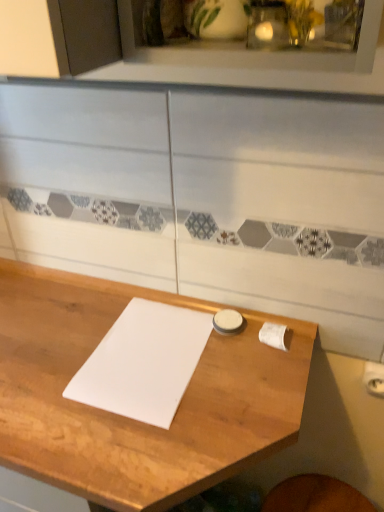
Find the location of `white matte journal at center`. white matte journal at center is located at coordinates (143, 362).

This screenshot has width=384, height=512. Describe the element at coordinates (143, 362) in the screenshot. I see `white matte journal at center` at that location.

I want to click on wooden table at center, so click(129, 419).

What do you see at coordinates (129, 419) in the screenshot? I see `wooden table at center` at bounding box center [129, 419].

The height and width of the screenshot is (512, 384). Identify the location of white matte journal at center. (143, 362).

Is white matte journal at center to the left of wooden table at center from the viewer's perspective?

No, white matte journal at center is not to the left of wooden table at center.

Which is behind, white matte journal at center or wooden table at center?

white matte journal at center is behind.

Considering the positions of point (156, 309) and point (181, 469), is point (156, 309) closer or farther from the camera than point (181, 469)?

Point (156, 309) is farther from the camera than point (181, 469).

From the picture: From the image's perspective, would you say white matte journal at center is positioned over wooden table at center?

Indeed, from the image's perspective, white matte journal at center is shown above wooden table at center.

From a real-world perspective, which object stands above the other?

white matte journal at center is physically above.

From the picture: Which object is wider, white matte journal at center or wooden table at center?

wooden table at center.

Considering the relative sizes of white matte journal at center and wooden table at center in the image provided, is white matte journal at center taller than wooden table at center?

In fact, white matte journal at center may be shorter than wooden table at center.

Is white matte journal at center bigger than wooden table at center?

Incorrect, white matte journal at center is not larger than wooden table at center.

Is white matte journal at center inside or outside of wooden table at center?

white matte journal at center fits inside wooden table at center.

Is white matte journal at center next to wooden table at center?

Yes, white matte journal at center is beside wooden table at center.

Is white matte journal at center aimed at wooden table at center?

Yes, white matte journal at center faces towards wooden table at center.

At what (x,y) coordinates should I click in order to perform the action: click on table on the left side of white matte journal at center. Please return your answer as a coordinate pair (x, y). The height and width of the screenshot is (512, 384). Looking at the image, I should click on (129, 419).

Does wooden table at center appear on the right side of white matte journal at center?

No, wooden table at center is not to the right of white matte journal at center.

Which is in front, wooden table at center or white matte journal at center?

wooden table at center is in front.

Is point (103, 284) closer to viewer compared to point (134, 376)?

That is False.

From the image's perspective, is wooden table at center above or below white matte journal at center?

Based on their image positions, wooden table at center is located beneath white matte journal at center.

Consider the image. From a real-world perspective, who is located higher, wooden table at center or white matte journal at center?

white matte journal at center.

Is wooden table at center wider or thinner than white matte journal at center?

wooden table at center is wider than white matte journal at center.

Considering the relative sizes of wooden table at center and white matte journal at center in the image provided, is wooden table at center taller than white matte journal at center?

Yes.

Which of these two, wooden table at center or white matte journal at center, is bigger?

Bigger between the two is wooden table at center.

Is wooden table at center situated inside white matte journal at center or outside?

wooden table at center exists outside the volume of white matte journal at center.

Is wooden table at center in contact with white matte journal at center?

Yes, wooden table at center is right next to white matte journal at center and making contact.

Does wooden table at center turn towards white matte journal at center?

No, wooden table at center is not aimed at white matte journal at center.

How far apart are wooden table at center and white matte journal at center?

The distance of wooden table at center from white matte journal at center is 3.73 inches.

You are a GUI agent. You are given a task and a screenshot of the screen. Output one action in this format:
    pyautogui.click(x=<x>, y=<y>)
    Task: Click on the table in front of the white matte journal at center
    The width and height of the screenshot is (384, 512).
    Given the screenshot: What is the action you would take?
    pyautogui.click(x=129, y=419)

I want to click on table in front of the white matte journal at center, so click(x=129, y=419).

Locate an element on the screen. Image resolution: width=384 pixels, height=512 pixels. journal behind the wooden table at center is located at coordinates (143, 362).